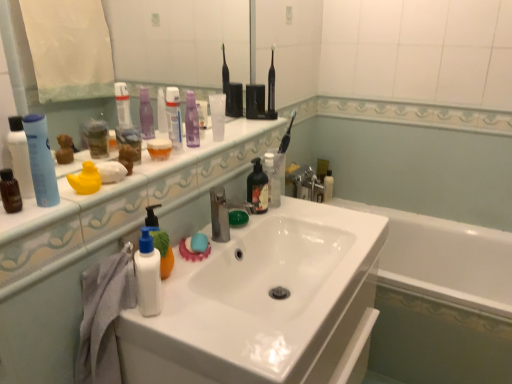
I want to click on free space in front of transparent plastic mouthwash at center, the fourth mouthwash from the left, so click(x=196, y=150).